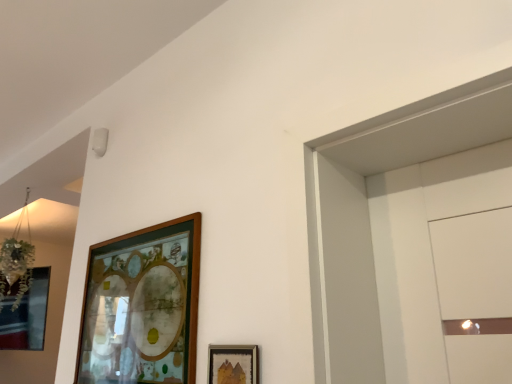
Locate an element on the screen. This screenshot has width=512, height=384. wooden picture frame at upper center, the first picture frame from the left is located at coordinates (142, 306).

Measure the distance between point (123, 292) and camera.

The distance of point (123, 292) from camera is 1.48 meters.

Describe the element at coordinates (142, 306) in the screenshot. I see `wooden picture frame at upper center, marked as the first picture frame in a back-to-front arrangement` at that location.

Find the location of `wooden frame at lower center, which is the 1th picture frame in front-to-back order`. wooden frame at lower center, which is the 1th picture frame in front-to-back order is located at coordinates (233, 364).

Describe the element at coordinates (233, 364) in the screenshot. I see `wooden frame at lower center, which is the 1th picture frame in front-to-back order` at that location.

In order to face wooden frame at lower center, the 2th picture frame in the back-to-front sequence, should I rotate leftwards or rightwards?

You should look left and rotate roughly 3.319 degrees.

What is the approximate width of wooden frame at lower center, positioned as the first picture frame in right-to-left order?

wooden frame at lower center, positioned as the first picture frame in right-to-left order, is 2.04 centimeters in width.

Find the location of a particular element. Image resolution: width=512 pixels, height=384 pixels. wooden picture frame at upper center, marked as the first picture frame in a back-to-front arrangement is located at coordinates click(x=142, y=306).

In the scene shown: Which object is positioned more to the right, wooden frame at lower center, positioned as the second picture frame in left-to-right order, or wooden picture frame at upper center, marked as the first picture frame in a back-to-front arrangement?

wooden frame at lower center, positioned as the second picture frame in left-to-right order.

Relative to wooden picture frame at upper center, which is counted as the second picture frame, starting from the front, is wooden frame at lower center, which is the 1th picture frame in front-to-back order, in front or behind?

In the image, wooden frame at lower center, which is the 1th picture frame in front-to-back order, appears in front of wooden picture frame at upper center, which is counted as the second picture frame, starting from the front.

Which is behind, point (216, 360) or point (149, 318)?

The point (149, 318) is farther.

From the image's perspective, which one is positioned higher, wooden frame at lower center, which is the 1th picture frame in front-to-back order, or wooden picture frame at upper center, the first picture frame from the left?

From the image's view, wooden picture frame at upper center, the first picture frame from the left, is above.

From a real-world perspective, between wooden frame at lower center, positioned as the first picture frame in right-to-left order, and wooden picture frame at upper center, the first picture frame from the left, who is vertically higher?

wooden picture frame at upper center, the first picture frame from the left.

Between wooden frame at lower center, positioned as the first picture frame in right-to-left order, and wooden picture frame at upper center, which is counted as the second picture frame, starting from the front, which one has smaller width?

wooden frame at lower center, positioned as the first picture frame in right-to-left order, is thinner.

Which of these two, wooden frame at lower center, the 2th picture frame in the back-to-front sequence, or wooden picture frame at upper center, the first picture frame from the left, stands taller?

wooden picture frame at upper center, the first picture frame from the left, is taller.

Does wooden frame at lower center, the 2th picture frame in the back-to-front sequence, have a smaller size compared to wooden picture frame at upper center, the first picture frame from the left?

Yes.

Can we say wooden frame at lower center, positioned as the first picture frame in right-to-left order, lies outside wooden picture frame at upper center, marked as the first picture frame in a back-to-front arrangement?

Yes.

Is wooden frame at lower center, positioned as the first picture frame in right-to-left order, in contact with wooden picture frame at upper center, the first picture frame from the left?

wooden frame at lower center, positioned as the first picture frame in right-to-left order, is not next to wooden picture frame at upper center, the first picture frame from the left, and they're not touching.

Is wooden frame at lower center, positioned as the second picture frame in left-to-right order, facing towards wooden picture frame at upper center, which is counted as the second picture frame, starting from the front?

No, wooden frame at lower center, positioned as the second picture frame in left-to-right order, is not facing towards wooden picture frame at upper center, which is counted as the second picture frame, starting from the front.

How many degrees apart are the facing directions of wooden frame at lower center, the 2th picture frame in the back-to-front sequence, and wooden picture frame at upper center, the first picture frame from the left?

The facing directions of wooden frame at lower center, the 2th picture frame in the back-to-front sequence, and wooden picture frame at upper center, the first picture frame from the left, are 0.14 degrees apart.

In order to click on picture frame below the wooden picture frame at upper center, which is counted as the second picture frame, starting from the front (from the image's perspective) in this screenshot , I will do `click(233, 364)`.

Considering the positions of objects wooden picture frame at upper center, the first picture frame from the left, and wooden frame at lower center, the 2th picture frame in the back-to-front sequence, in the image provided, who is more to the right, wooden picture frame at upper center, the first picture frame from the left, or wooden frame at lower center, the 2th picture frame in the back-to-front sequence,?

wooden frame at lower center, the 2th picture frame in the back-to-front sequence.

Relative to wooden frame at lower center, positioned as the first picture frame in right-to-left order, is wooden picture frame at upper center, marked as the first picture frame in a back-to-front arrangement, in front or behind?

Visually, wooden picture frame at upper center, marked as the first picture frame in a back-to-front arrangement, is located behind wooden frame at lower center, positioned as the first picture frame in right-to-left order.

Which is farther, (x=170, y=323) or (x=212, y=355)?

The point (x=170, y=323) is farther.

From the image's perspective, is wooden picture frame at upper center, marked as the first picture frame in a back-to-front arrangement, on wooden frame at lower center, positioned as the second picture frame in left-to-right order?

Indeed, from the image's perspective, wooden picture frame at upper center, marked as the first picture frame in a back-to-front arrangement, is shown above wooden frame at lower center, positioned as the second picture frame in left-to-right order.

From a real-world perspective, is wooden picture frame at upper center, marked as the first picture frame in a back-to-front arrangement, below wooden frame at lower center, positioned as the second picture frame in left-to-right order?

No, from a real-world perspective, wooden picture frame at upper center, marked as the first picture frame in a back-to-front arrangement, is not under wooden frame at lower center, positioned as the second picture frame in left-to-right order.

Which of these two, wooden picture frame at upper center, placed as the second picture frame when sorted from right to left, or wooden frame at lower center, positioned as the first picture frame in right-to-left order, is thinner?

Thinner between the two is wooden frame at lower center, positioned as the first picture frame in right-to-left order.

Is wooden picture frame at upper center, placed as the second picture frame when sorted from right to left, shorter than wooden frame at lower center, which is the 1th picture frame in front-to-back order?

No, wooden picture frame at upper center, placed as the second picture frame when sorted from right to left, is not shorter than wooden frame at lower center, which is the 1th picture frame in front-to-back order.

Can you confirm if wooden picture frame at upper center, the first picture frame from the left, is smaller than wooden frame at lower center, positioned as the first picture frame in right-to-left order?

No, wooden picture frame at upper center, the first picture frame from the left, is not smaller than wooden frame at lower center, positioned as the first picture frame in right-to-left order.

Is wooden picture frame at upper center, placed as the second picture frame when sorted from right to left, outside of wooden frame at lower center, positioned as the first picture frame in right-to-left order?

That's correct, wooden picture frame at upper center, placed as the second picture frame when sorted from right to left, is outside of wooden frame at lower center, positioned as the first picture frame in right-to-left order.

Is there a large distance between wooden picture frame at upper center, which is counted as the second picture frame, starting from the front, and wooden frame at lower center, positioned as the second picture frame in left-to-right order?

No, wooden picture frame at upper center, which is counted as the second picture frame, starting from the front, is not far from wooden frame at lower center, positioned as the second picture frame in left-to-right order.

Is wooden picture frame at upper center, placed as the second picture frame when sorted from right to left, facing towards wooden frame at lower center, positioned as the second picture frame in left-to-right order?

No, wooden picture frame at upper center, placed as the second picture frame when sorted from right to left, does not turn towards wooden frame at lower center, positioned as the second picture frame in left-to-right order.

How many degrees apart are the facing directions of wooden picture frame at upper center, marked as the first picture frame in a back-to-front arrangement, and wooden frame at lower center, positioned as the first picture frame in right-to-left order?

There is a 0.14-degree angle between the facing directions of wooden picture frame at upper center, marked as the first picture frame in a back-to-front arrangement, and wooden frame at lower center, positioned as the first picture frame in right-to-left order.

In order to click on picture frame to the left of wooden frame at lower center, the 2th picture frame in the back-to-front sequence in this screenshot , I will do `click(142, 306)`.

This screenshot has height=384, width=512. Find the location of `picture frame above the wooden frame at lower center, positioned as the second picture frame in left-to-right order (from a real-world perspective)`. picture frame above the wooden frame at lower center, positioned as the second picture frame in left-to-right order (from a real-world perspective) is located at coordinates (142, 306).

In order to click on picture frame in front of the wooden picture frame at upper center, marked as the first picture frame in a back-to-front arrangement in this screenshot , I will do `click(233, 364)`.